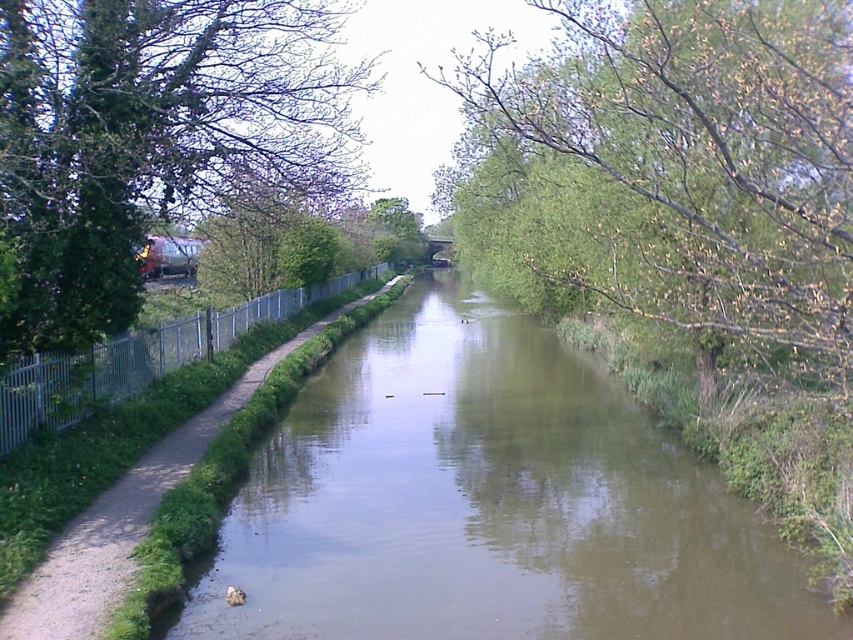
Based on the photo, is green leafy tree at center positioned behind green leafy tree at left?

No, it is not.

Based on the photo, does green leafy tree at center have a lesser height compared to green leafy tree at left?

Correct, green leafy tree at center is not as tall as green leafy tree at left.

Describe the element at coordinates (703, 156) in the screenshot. I see `green leafy tree at center` at that location.

The image size is (853, 640). I want to click on green leafy tree at center, so click(x=703, y=156).

Is green smooth water at center closer to the viewer compared to green leafy tree at left?

Yes, green smooth water at center is closer to the viewer.

Consider the image. Between green smooth water at center and green leafy tree at left, which one appears on the left side from the viewer's perspective?

green leafy tree at left

This screenshot has width=853, height=640. What do you see at coordinates (488, 502) in the screenshot? I see `green smooth water at center` at bounding box center [488, 502].

Where is `green smooth water at center`? green smooth water at center is located at coordinates (488, 502).

Which is more to the left, green smooth water at center or silver metallic fence at left?

From the viewer's perspective, silver metallic fence at left appears more on the left side.

Does green smooth water at center come behind silver metallic fence at left?

No, green smooth water at center is closer to the viewer.

What do you see at coordinates (488, 502) in the screenshot? The image size is (853, 640). I see `green smooth water at center` at bounding box center [488, 502].

At what (x,y) coordinates should I click in order to perform the action: click on green smooth water at center. Please return your answer as a coordinate pair (x, y). This screenshot has height=640, width=853. Looking at the image, I should click on (488, 502).